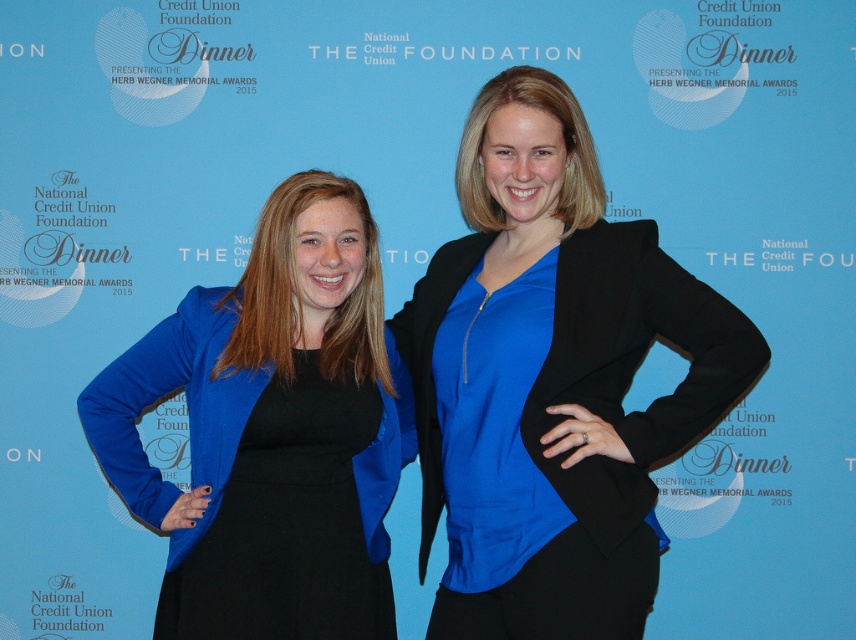
Can you confirm if black matte blazer at center is smaller than black satin dress at center?

Yes, black matte blazer at center is smaller than black satin dress at center.

Which is more to the right, black matte blazer at center or black satin dress at center?

black matte blazer at center

Where is `black matte blazer at center`? black matte blazer at center is located at coordinates (635, 364).

Where is `black matte blazer at center`? This screenshot has width=856, height=640. black matte blazer at center is located at coordinates (635, 364).

Which of these two, matte blue blazer at center or black satin dress at center, stands shorter?

black satin dress at center is shorter.

Locate an element on the screen. The image size is (856, 640). matte blue blazer at center is located at coordinates (272, 432).

Between matte blue blazer at center and black matte blazer at center, which one appears on the right side from the viewer's perspective?

black matte blazer at center

Is point (117, 458) positioned before point (437, 280)?

Yes, it is in front of point (437, 280).

What do you see at coordinates (272, 432) in the screenshot? The width and height of the screenshot is (856, 640). I see `matte blue blazer at center` at bounding box center [272, 432].

Find the location of a particular element. matte blue blazer at center is located at coordinates (272, 432).